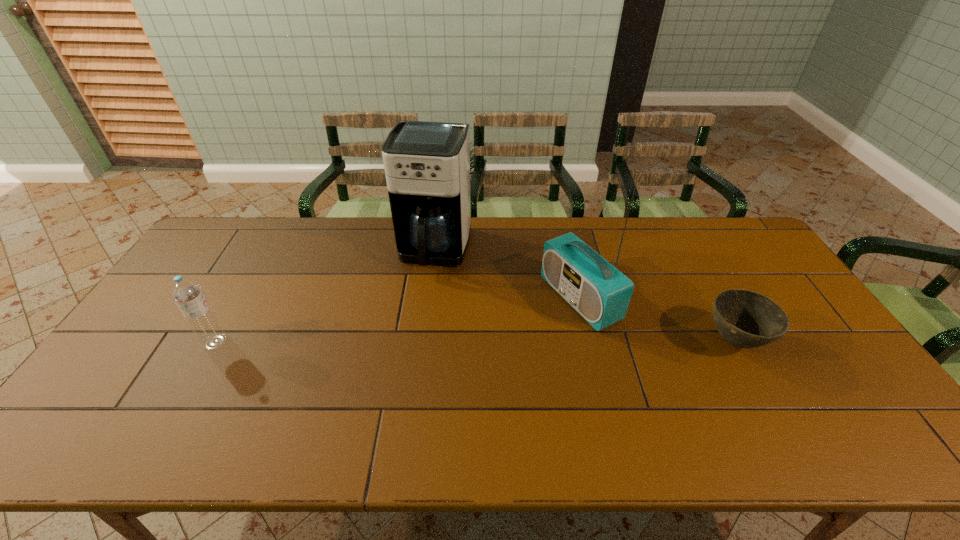
The image size is (960, 540). What are the coordinates of `vacant space that's between the coffee maker and the leftmost object` in the screenshot? It's located at (325, 295).

This screenshot has width=960, height=540. Find the location of `free space between the radio receiver and the rightmost object`. free space between the radio receiver and the rightmost object is located at coordinates (657, 320).

Find the location of `free space between the second shortest object and the second object from right to left`. free space between the second shortest object and the second object from right to left is located at coordinates (397, 320).

The height and width of the screenshot is (540, 960). Identify the location of free space between the shortest object and the second shortest object. (475, 341).

Locate an element on the screen. This screenshot has height=540, width=960. free space that is in between the second shortest object and the second object from right to left is located at coordinates (397, 320).

Identify the location of free space between the second shortest object and the third object from left to right. This screenshot has width=960, height=540. (397, 320).

Locate an element on the screen. The height and width of the screenshot is (540, 960). vacant space in between the coffee maker and the radio receiver is located at coordinates (508, 274).

Identify the location of free space between the radio receiver and the second shortest object. (397, 320).

Select which object is the second closest to the coffee maker. Please provide its 2D coordinates. Your answer should be formatted as a tuple, i.e. [(x, y)], where the tuple contains the x and y coordinates of a point satisfying the conditions above.

[(187, 294)]

Point out which object is positioned as the third nearest to the coffee maker. Please provide its 2D coordinates. Your answer should be formatted as a tuple, i.e. [(x, y)], where the tuple contains the x and y coordinates of a point satisfying the conditions above.

[(747, 319)]